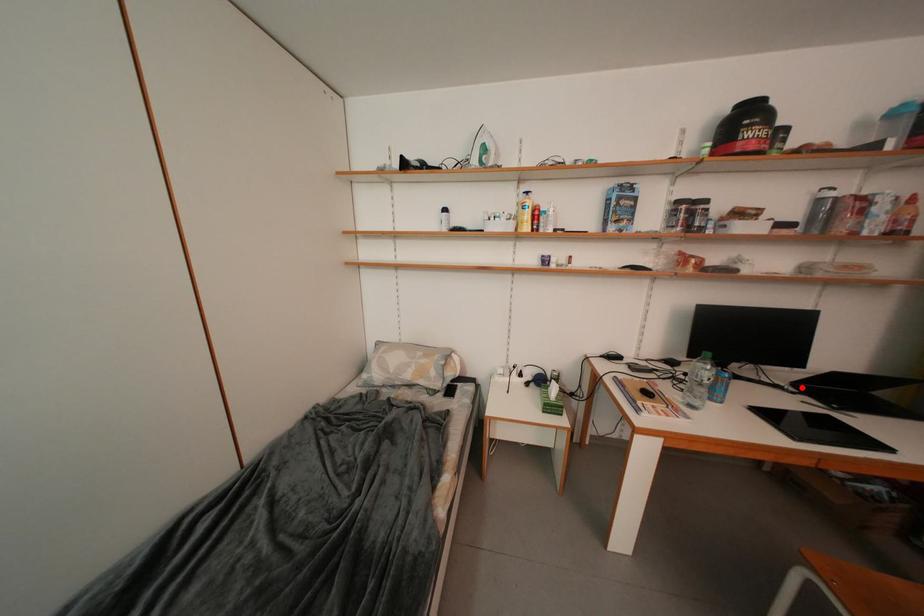
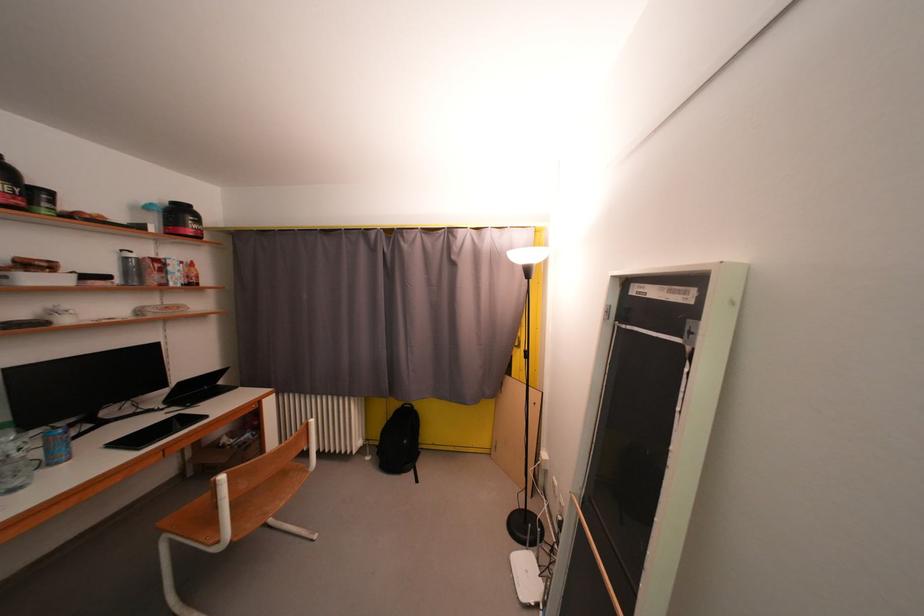
In the second image, find the point that corresponds to the highlighted location in the first image.

(174, 405)